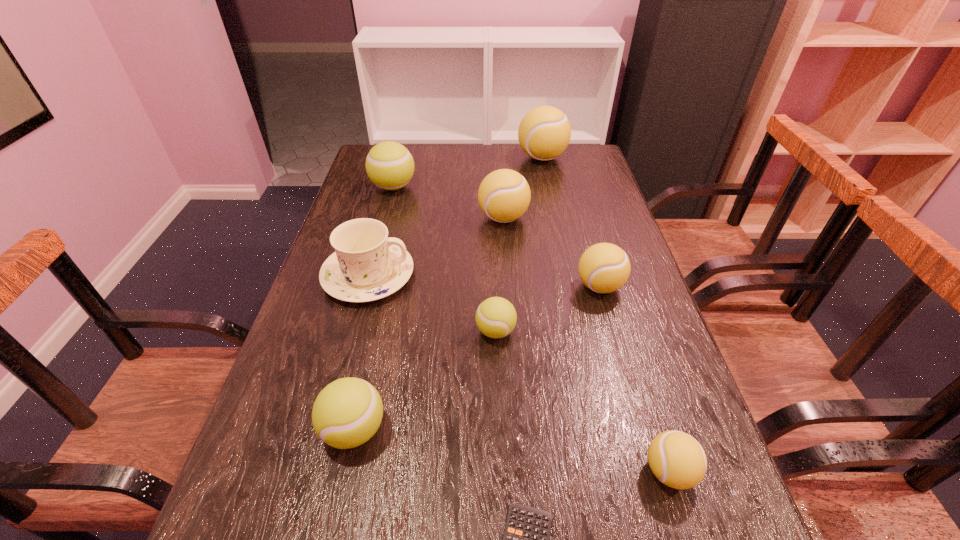
This screenshot has height=540, width=960. Identify the location of the second nearest green tennis ball. (496, 317).

Locate an element on the screen. the sixth farthest object is located at coordinates (496, 317).

Where is `the smallest yellow tennis ball`? the smallest yellow tennis ball is located at coordinates (677, 459).

In order to click on vacant point located 0.340m on the left of the tallest object in this screenshot , I will do `click(420, 158)`.

Image resolution: width=960 pixels, height=540 pixels. What are the coordinates of `vacant area situated on the left of the seventh nearest object` in the screenshot? It's located at (410, 218).

This screenshot has width=960, height=540. What are the coordinates of `vacant space located 0.380m on the right of the eighth nearest object` in the screenshot? It's located at (535, 187).

You are a GUI agent. You are given a task and a screenshot of the screen. Output one action in this format:
    pyautogui.click(x=<x>, y=<y>)
    Task: Click on the vacant area situated on the handle side of the chinaware
    
    Given the screenshot: What is the action you would take?
    pyautogui.click(x=466, y=276)

Locate an element on the screen. The image size is (960, 540). free spot located 0.380m on the left of the third biggest yellow tennis ball is located at coordinates (421, 286).

The width and height of the screenshot is (960, 540). What are the coordinates of `free region located 0.290m on the right of the nearest green tennis ball` in the screenshot? It's located at (545, 430).

Locate an element on the screen. free region located 0.100m on the right of the rightmost green tennis ball is located at coordinates (561, 331).